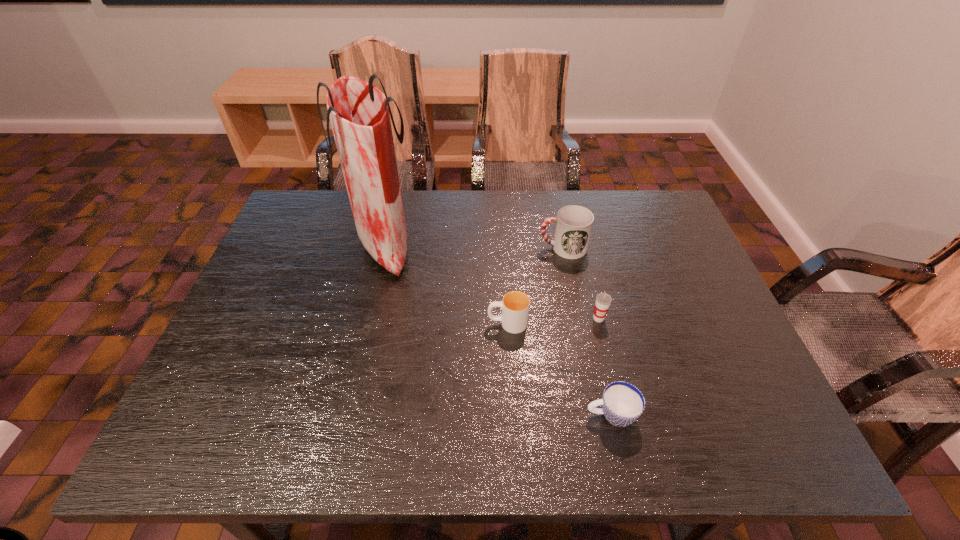
You are a GUI agent. You are given a task and a screenshot of the screen. Output one action in this format:
    pyautogui.click(x=<x>, y=<y>)
    Task: Click on the free area in between the fourth tallest object and the leftmost object
    
    Given the screenshot: What is the action you would take?
    pyautogui.click(x=446, y=284)

The image size is (960, 540). What are the coordinates of `vacant space that's between the farthest cup and the shortest cup` in the screenshot? It's located at (587, 332).

Image resolution: width=960 pixels, height=540 pixels. Find the location of `vacant space that's between the nearest cup and the farthest cup`. vacant space that's between the nearest cup and the farthest cup is located at coordinates (587, 332).

Locate an element on the screen. Image resolution: width=960 pixels, height=540 pixels. free space between the shortest object and the farthest cup is located at coordinates (587, 332).

Select which object is the closest to the fourth tallest object. Please provide its 2D coordinates. Your answer should be formatted as a tuple, i.e. [(x, y)], where the tuple contains the x and y coordinates of a point satisfying the conditions above.

[(603, 300)]

Locate which object is the closest to the third tallest cup. Please provide its 2D coordinates. Your answer should be formatted as a tuple, i.e. [(x, y)], where the tuple contains the x and y coordinates of a point satisfying the conditions above.

[(603, 300)]

Where is `cup that is the second closest one to the tallest object`? cup that is the second closest one to the tallest object is located at coordinates (574, 223).

Identify which cup is located as the nearest to the tallest object. Please provide its 2D coordinates. Your answer should be formatted as a tuple, i.e. [(x, y)], where the tuple contains the x and y coordinates of a point satisfying the conditions above.

[(515, 306)]

Identify the location of blank area in the image that satisfies the following two spatial constraints: 1. with the handle on the side of the fourth tallest object; 2. on the front side of the leftmost object. (503, 245).

Image resolution: width=960 pixels, height=540 pixels. Identify the location of vacant area that satisfies the following two spatial constraints: 1. on the front side of the leftmost object; 2. on the side of the farthest cup where the handle is located. (384, 248).